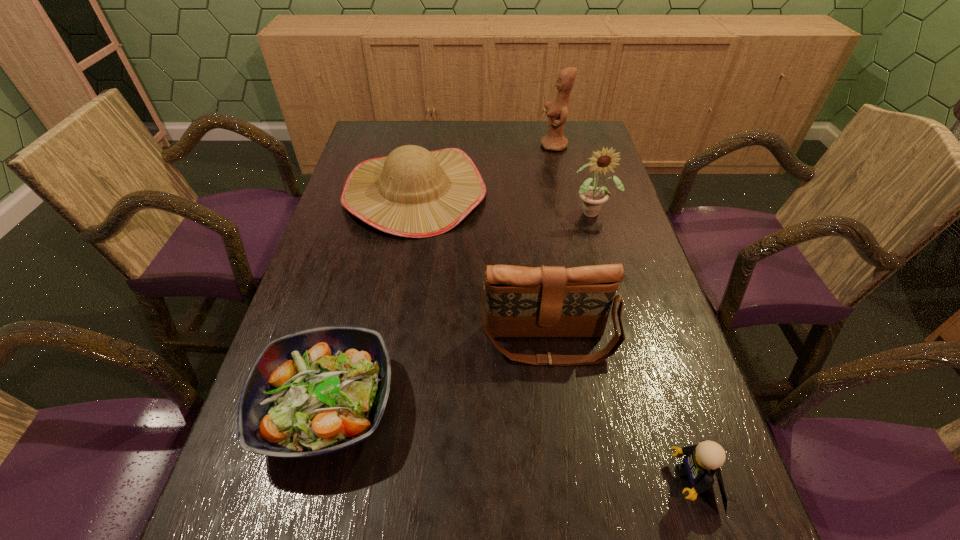
Where is `salad plate located at the left edge`? Image resolution: width=960 pixels, height=540 pixels. salad plate located at the left edge is located at coordinates (318, 391).

The height and width of the screenshot is (540, 960). What are the coordinates of `figurine present at the right edge` in the screenshot? It's located at (557, 111).

I want to click on sunflower located at the right edge, so click(x=592, y=198).

Identify the location of shoulder bag located at the right edge. (521, 301).

Find the location of a particular element. This screenshot has width=960, height=540. Lego that is at the right edge is located at coordinates (702, 461).

At what (x,y) coordinates should I click in order to perform the action: click on object at the far left corner. Please return your answer as a coordinate pair (x, y). The width and height of the screenshot is (960, 540). Looking at the image, I should click on (413, 192).

The width and height of the screenshot is (960, 540). I want to click on object positioned at the far right corner, so click(x=557, y=111).

Identify the location of vacant space at the far edge. (519, 126).

This screenshot has height=540, width=960. I want to click on free space at the left edge of the desktop, so [x=334, y=265].

Find the location of a particular element. The width and height of the screenshot is (960, 540). free space at the right edge of the desktop is located at coordinates (624, 225).